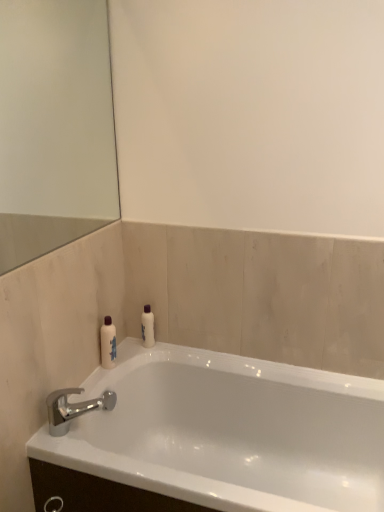
Identify the location of vacant space in front of white glossy bottle at upper center, which ranks as the 2th toiletry in left-to-right order. (134, 358).